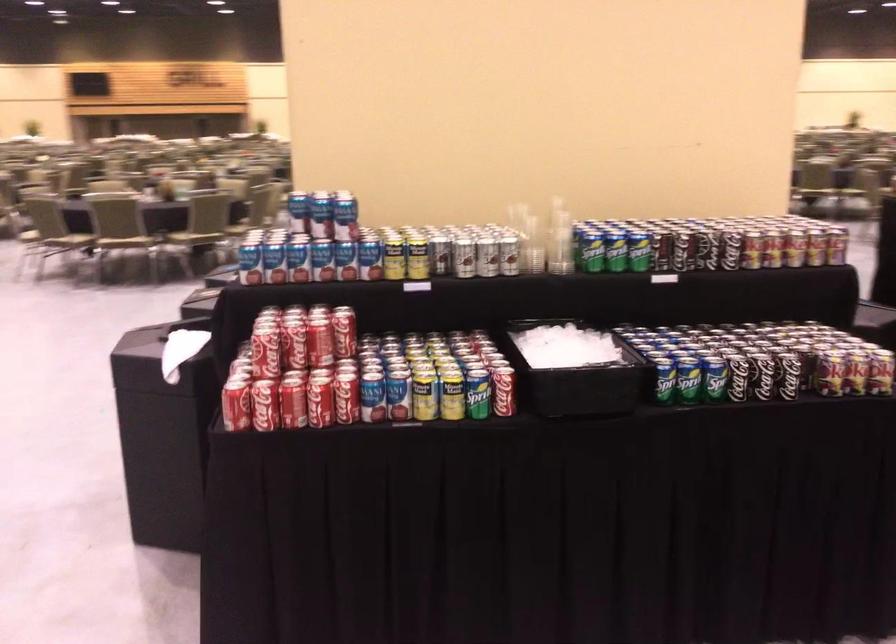
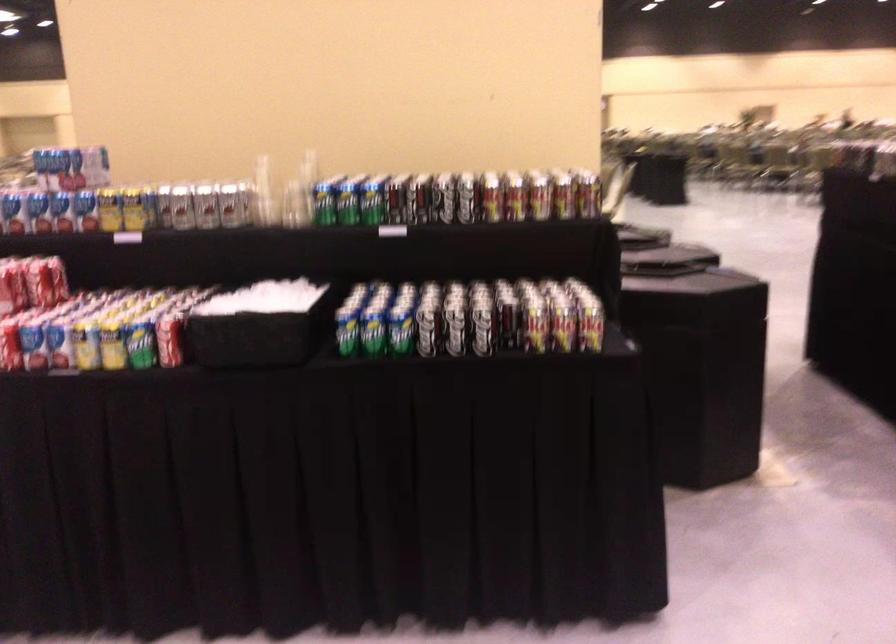
Locate, in the second image, the point that corresponds to point (435, 254) in the first image.

(162, 205)